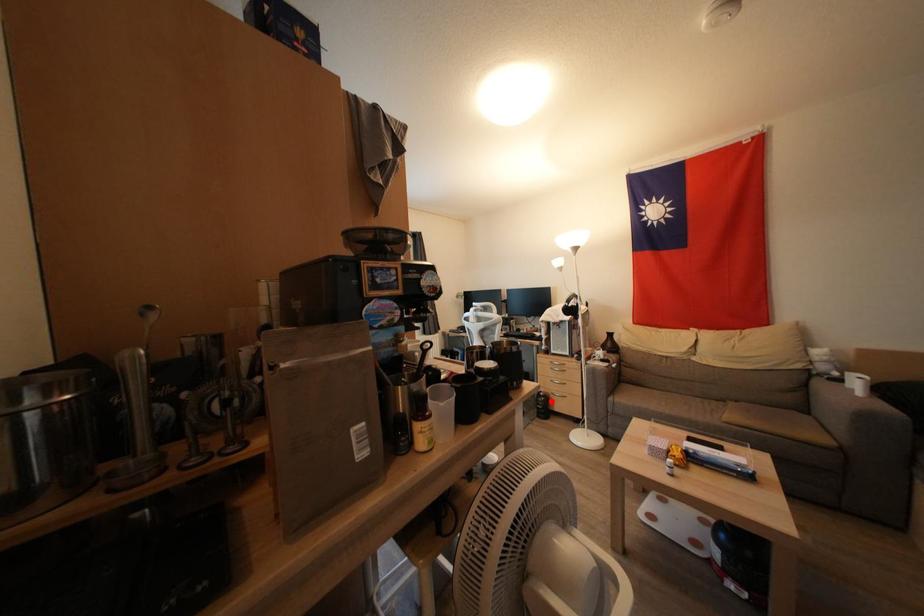
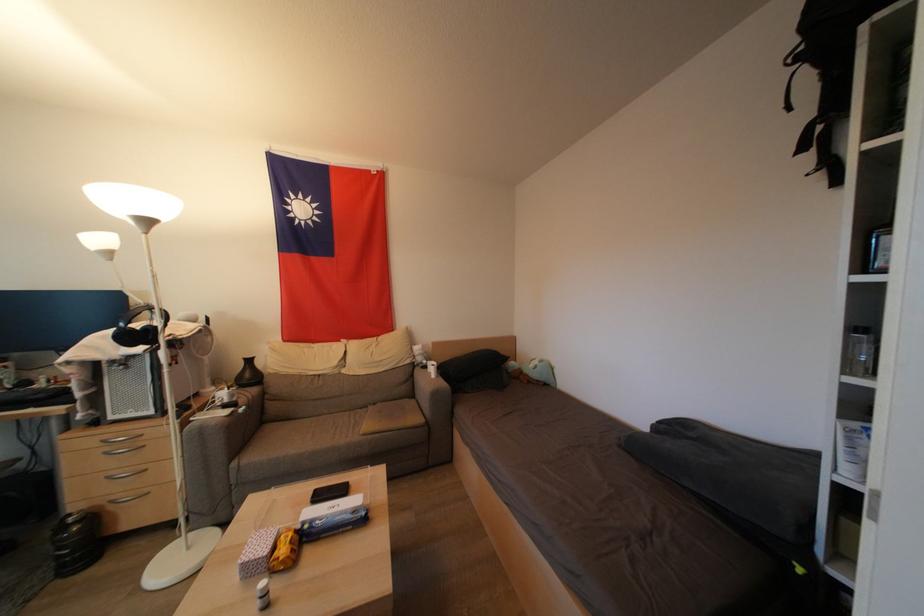
In the second image, find the point that corresponds to the highlighted location in the first image.

(99, 521)